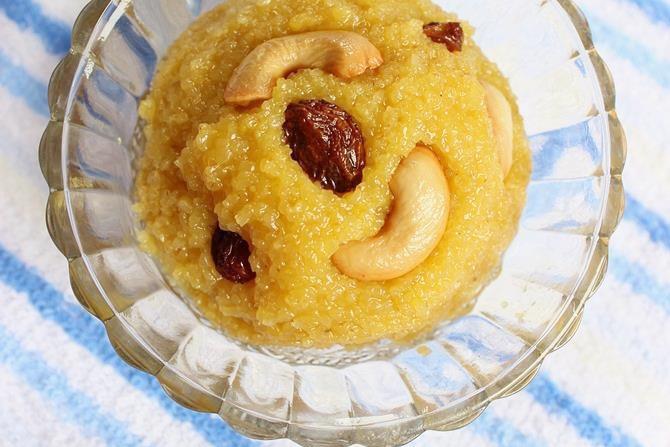
You are a GUI agent. You are given a task and a screenshot of the screen. Output one action in this format:
    pyautogui.click(x=<x>, y=<y>)
    Task: Click on the empty table place to the bottom right of bowl
    
    Given the screenshot: What is the action you would take?
    point(598,366)